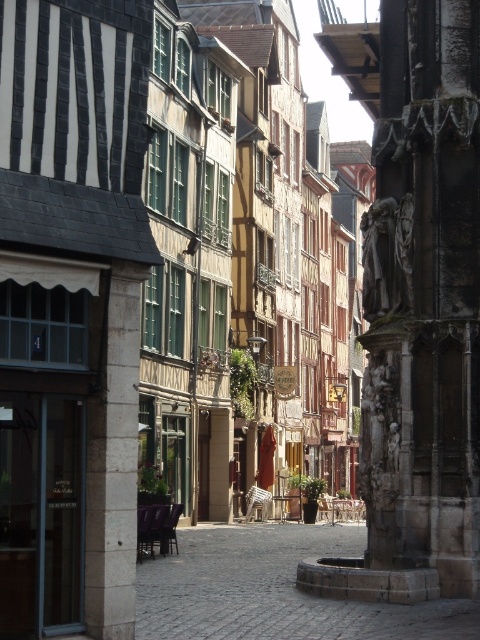
Based on the photo, which is below, dark stone sculpture at right or brown cobblestone alley at center?

brown cobblestone alley at center is lower down.

Between dark stone sculpture at right and brown cobblestone alley at center, which one appears on the right side from the viewer's perspective?

From the viewer's perspective, dark stone sculpture at right appears more on the right side.

Identify the location of dark stone sculpture at right. The height and width of the screenshot is (640, 480). (423, 298).